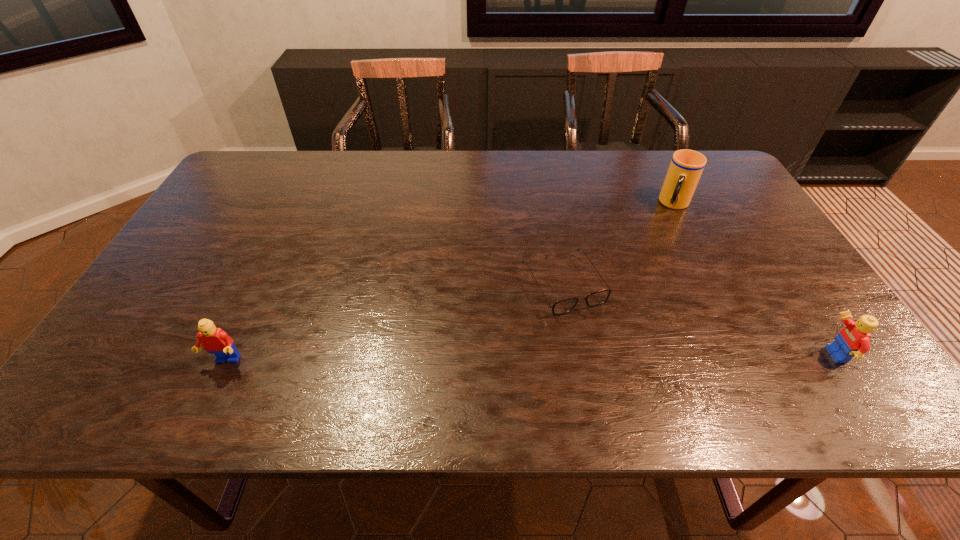
This screenshot has width=960, height=540. In order to click on vacant space located on the front-facing side of the second object from left to right in this screenshot , I will do `click(610, 361)`.

The height and width of the screenshot is (540, 960). What are the coordinates of `vacant space located 0.360m on the side of the cup with the handle` in the screenshot? It's located at (641, 295).

Image resolution: width=960 pixels, height=540 pixels. I want to click on free region located 0.360m on the side of the cup with the handle, so click(641, 295).

Where is `vacant area situated 0.280m on the side of the cup with the handle`? This screenshot has height=540, width=960. vacant area situated 0.280m on the side of the cup with the handle is located at coordinates (650, 274).

Find the location of a particular element. The height and width of the screenshot is (540, 960). object that is at the right edge is located at coordinates (852, 342).

Where is `object located in the near right corner section of the desktop`? The width and height of the screenshot is (960, 540). object located in the near right corner section of the desktop is located at coordinates (852, 342).

Identify the location of free space at the far edge of the desktop. (620, 153).

Where is `vacant space at the left edge of the desktop`? vacant space at the left edge of the desktop is located at coordinates (240, 202).

At what (x,y) coordinates should I click in order to perform the action: click on free space at the right edge. Please return your answer as a coordinate pair (x, y). Looking at the image, I should click on (741, 241).

Locate an element on the screen. This screenshot has height=540, width=960. vacant space at the far left corner of the desktop is located at coordinates (230, 177).